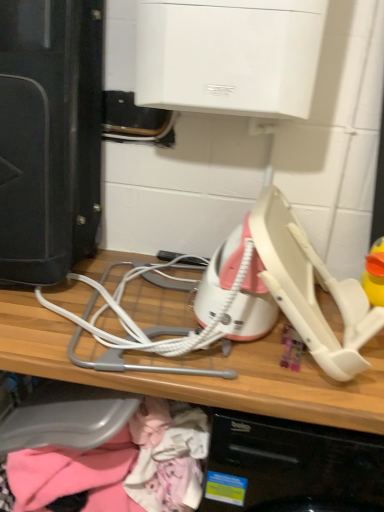
Question: Considering the positions of pink fabric at lower left and white plastic computer at center in the image, is pink fabric at lower left bigger or smaller than white plastic computer at center?

Choices:
 (A) big
 (B) small

Answer: (B)

Question: From the image's perspective, is pink fabric at lower left located above or below white plastic computer at center?

Choices:
 (A) below
 (B) above

Answer: (A)

Question: Which object is the closest to the pink fabric at lower left?

Choices:
 (A) black plastic speaker at left
 (B) white plastic computer at center

Answer: (B)

Question: Estimate the real-world distances between objects in this image. Which object is closer to the white plastic computer at center?

Choices:
 (A) black plastic speaker at left
 (B) pink fabric at lower left

Answer: (B)